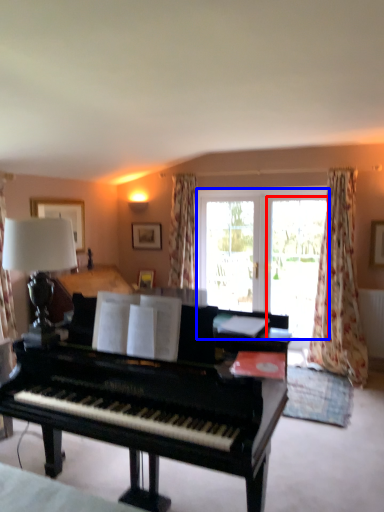
Question: Which point is closer to the camera, screen door (highlighted by a red box) or bay window (highlighted by a blue box)?

Choices:
 (A) screen door
 (B) bay window

Answer: (A)